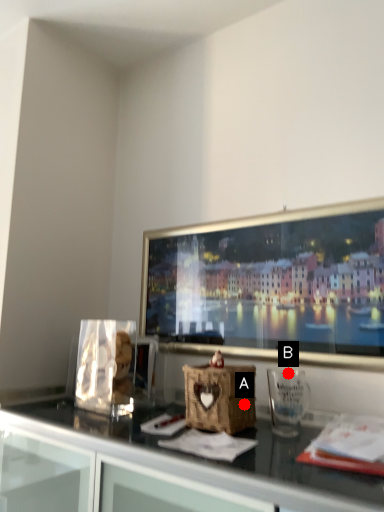
Question: Two points are circled on the image, labeled by A and B beside each circle. Which point appears farthest from the camera in this image?

Choices:
 (A) A is further
 (B) B is further

Answer: (B)